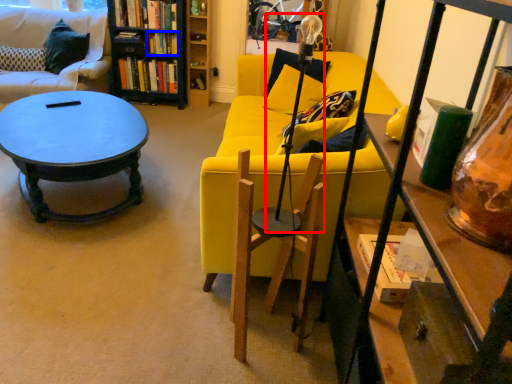
Question: Which object appears closest to the camera in this image, lamp (highlighted by a red box) or book (highlighted by a blue box)?

Choices:
 (A) lamp
 (B) book

Answer: (A)